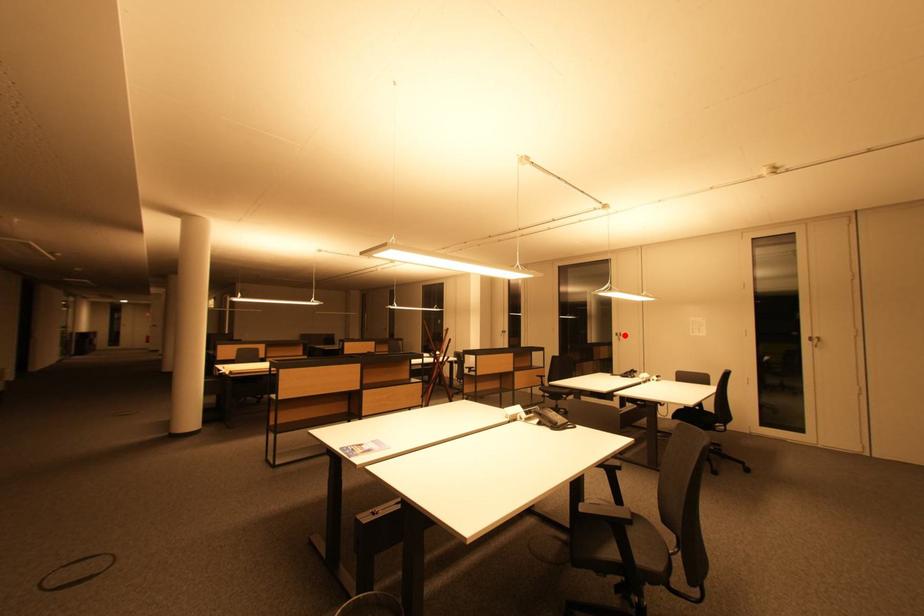
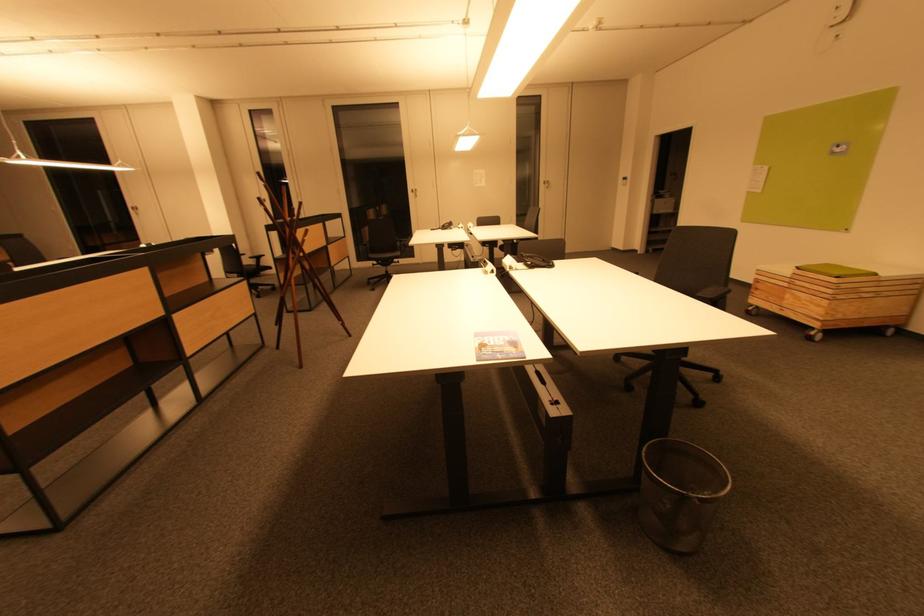
Locate, in the second image, the point that corresponds to the highlighted location in the first image.

(419, 191)